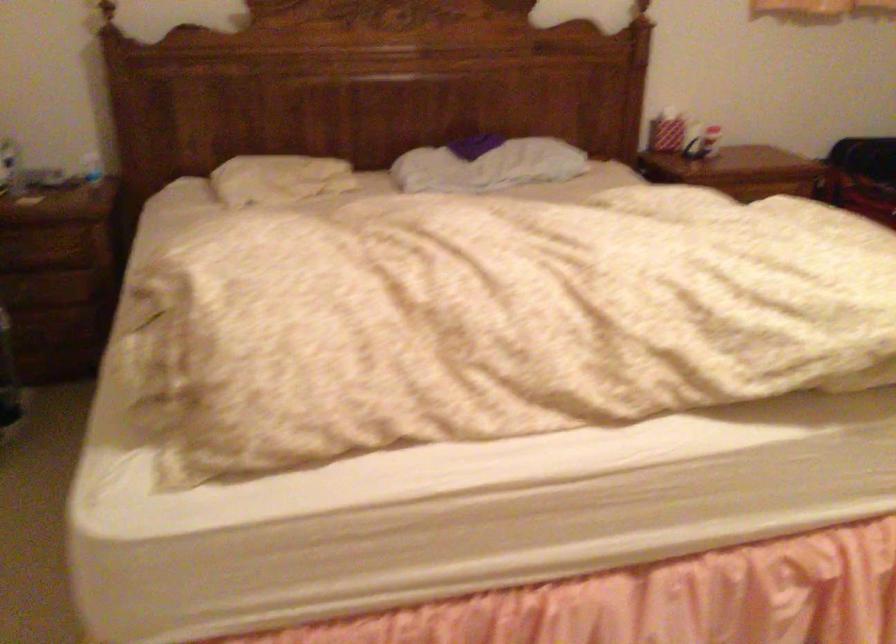
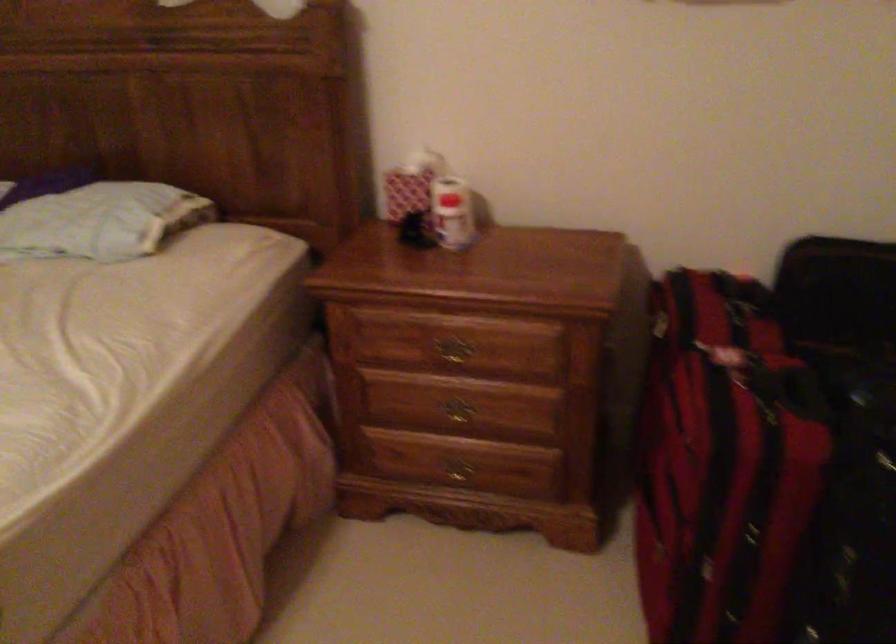
In the second image, find the point that corresponds to point 748,196 in the first image.

(452, 353)